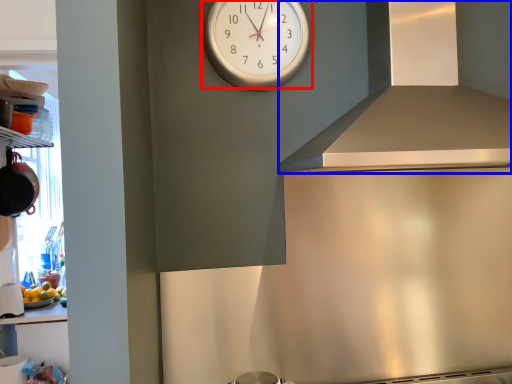
Question: Which object is closer to the camera taking this photo, wall clock (highlighted by a red box) or exhaust hood (highlighted by a blue box)?

Choices:
 (A) wall clock
 (B) exhaust hood

Answer: (B)